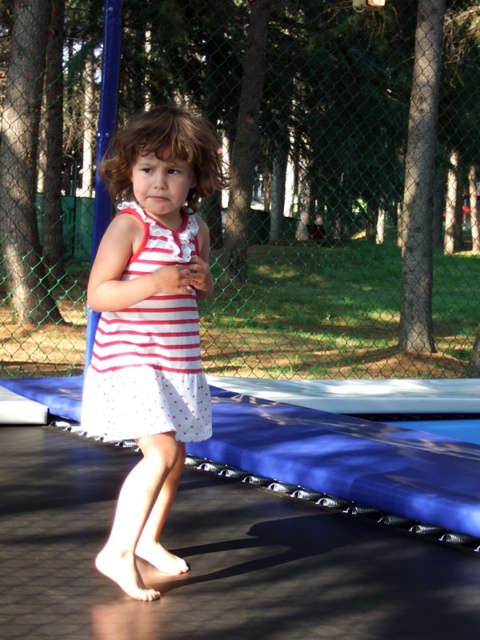
You are a photographer trying to capture a clear shot of the child on the trampoline. You notice two dresses in the image. Which dress is positioned closer to you between the white polka dot dress at center and the white dotted dress at center?

The white polka dot dress at center is closer to the viewer than the white dotted dress at center.

You are a photographer trying to capture the white polka dot dress at center in the center of your photo. Based on the coordinates provided, is the dress already centered in the image?

The white polka dot dress at center is located at coordinates point [151,326], which is very close to the center of the image. Since the coordinates are nearly centered, the dress is already centered in the image.